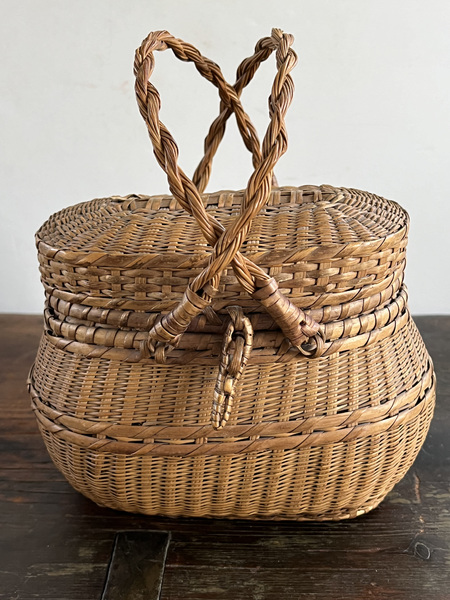
Locate an element on the screen. The image size is (450, 600). top of basket handles is located at coordinates (154, 35), (283, 37).